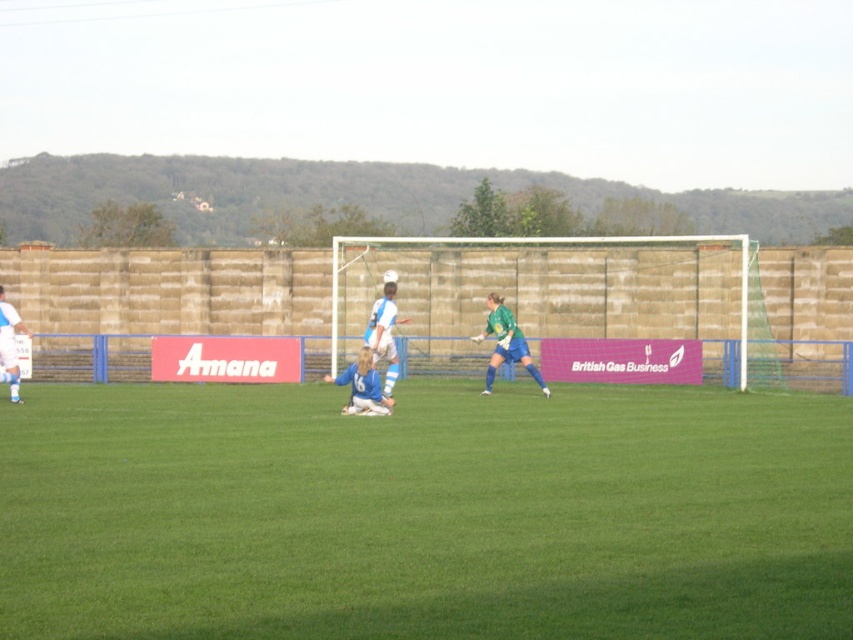
You are a soccer player who just kicked the ball. You see the green jersey at center and the white matte soccer ball at center. Which one is to the right?

The green jersey at center is positioned on the right side of white matte soccer ball at center, so the green jersey at center is to the right.

You are a soccer player positioned at the center of the field. You need to decide which direction to pass the ball to reach either the point at coordinates point [328,380] or point [3,339] first. Which point should you aim for?

The point at coordinates point [328,380] is closer to the viewer than point [3,339], so you should aim for point [328,380] first.

You are a photographer standing at the center of the soccer field. You want to take a picture of the blue jersey at center. Where should you point your camera to capture it?

You should point your camera at point 0.605 on the x axis and 0.426 on the y axis to capture the blue jersey at center.